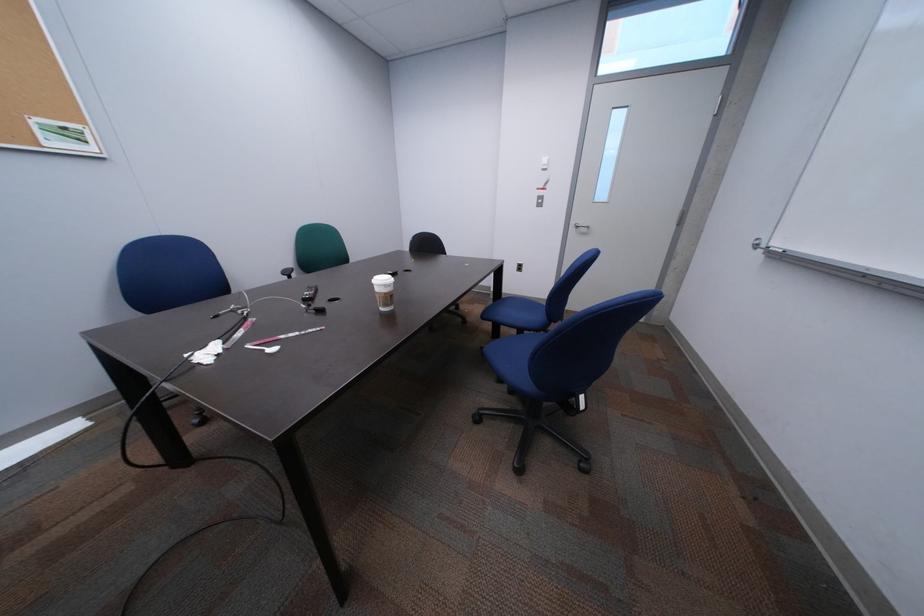
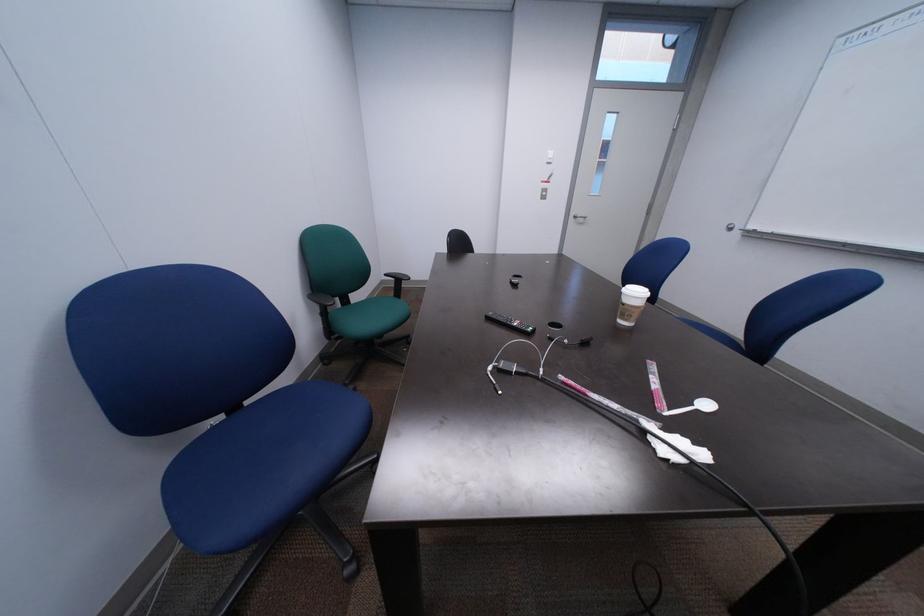
In a continuous first-person perspective shot, in which direction is the camera moving?

The cameraman moved toward left, forward.